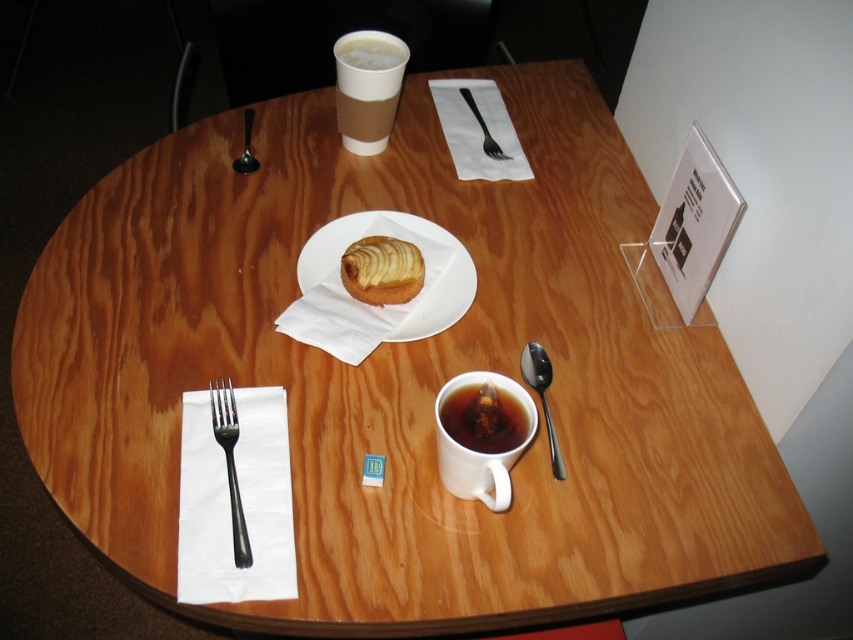
You are a customer at the table and want to reach both the golden flaky pastry at center and the silver metallic fork at left. Which item is shorter?

The golden flaky pastry at center is shorter than the silver metallic fork at left.

You are a server in a cafe and you need to place a new menu on the table. The menu is 10 cm wide. You want to place it next to the satin silver spoon at right and the matte plastic cup at upper center. Which object can the menu be placed next to without overlapping, considering their widths?

The satin silver spoon at right has a lesser width compared to the matte plastic cup at upper center. Since the menu is 10 cm wide, it can be placed next to the satin silver spoon at right as it is narrower, allowing more space for the menu without overlapping.